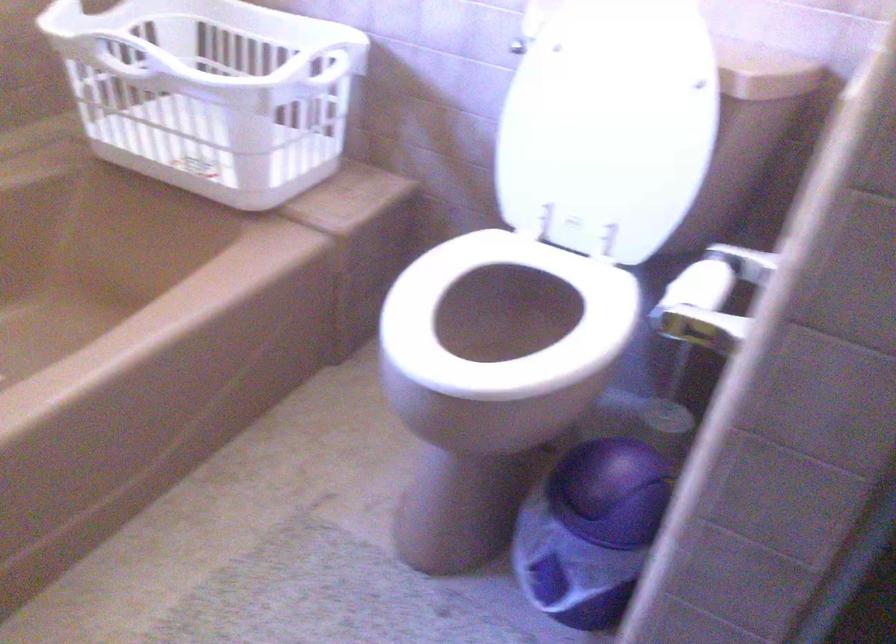
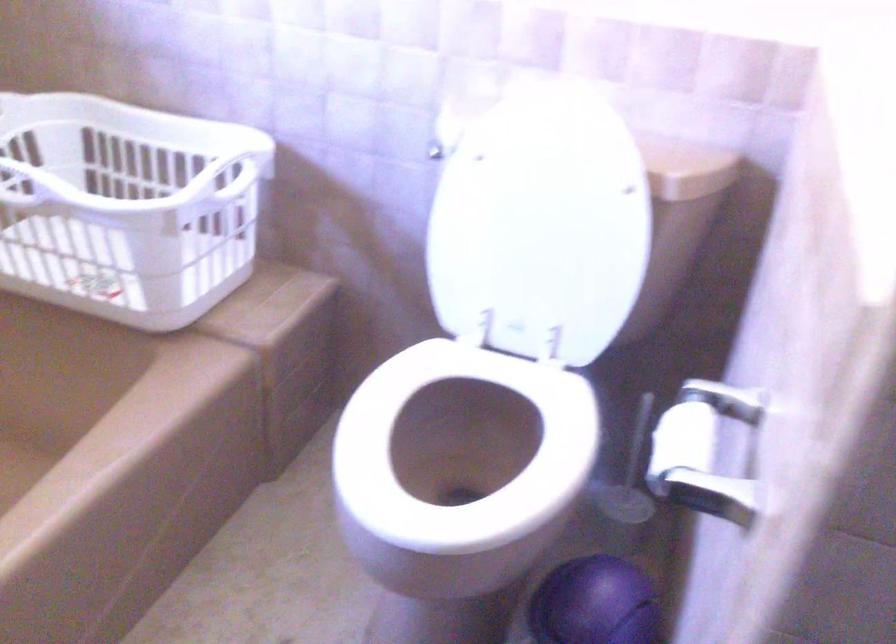
The images are taken continuously from a first-person perspective. In which direction are you moving?

The cameraman moved toward left, forward.